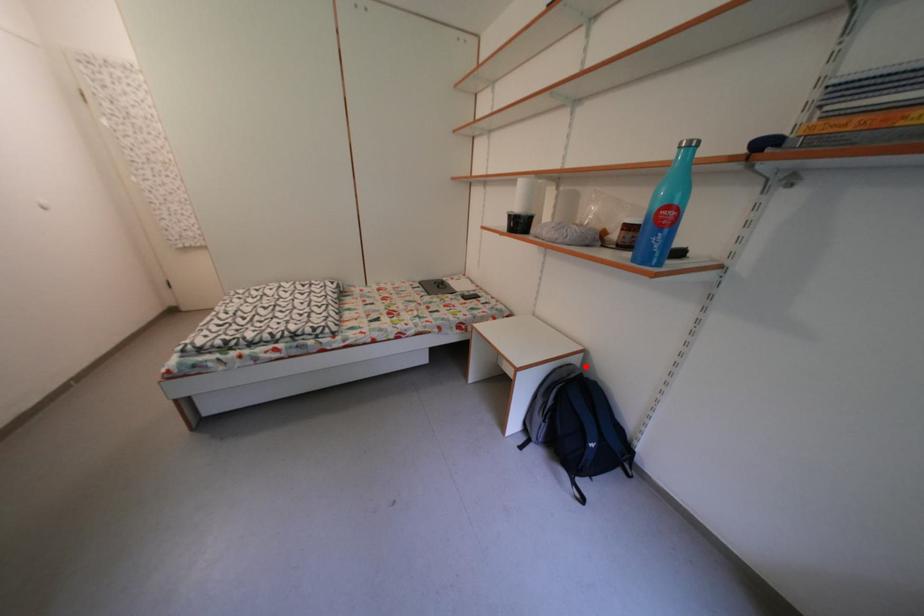
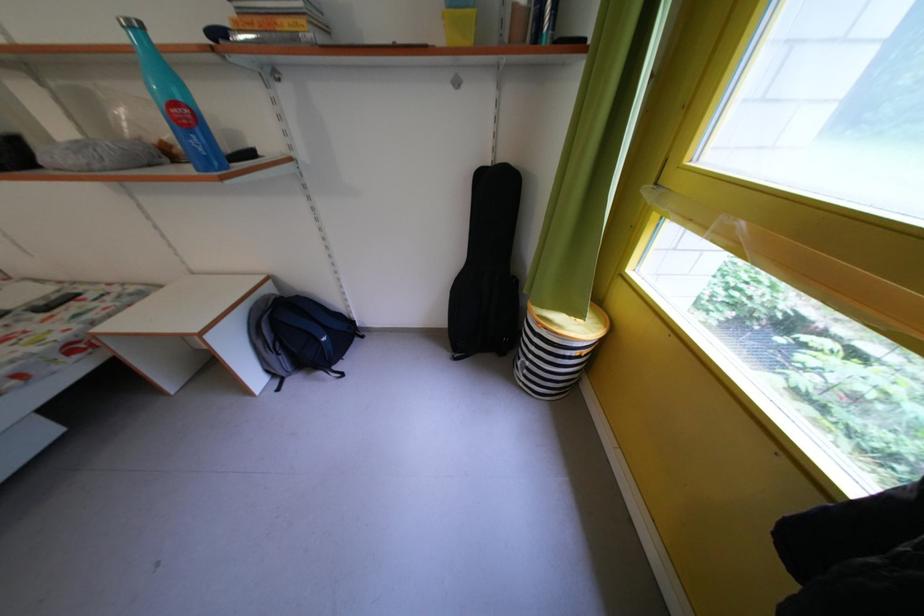
Question: I am providing you with two images of the same scene from different viewpoints. A red point is shown in image1. For the corresponding object point in image2, is it positioned nearer or farther from the camera?

Choices:
 (A) Nearer
 (B) Farther

Answer: (A)